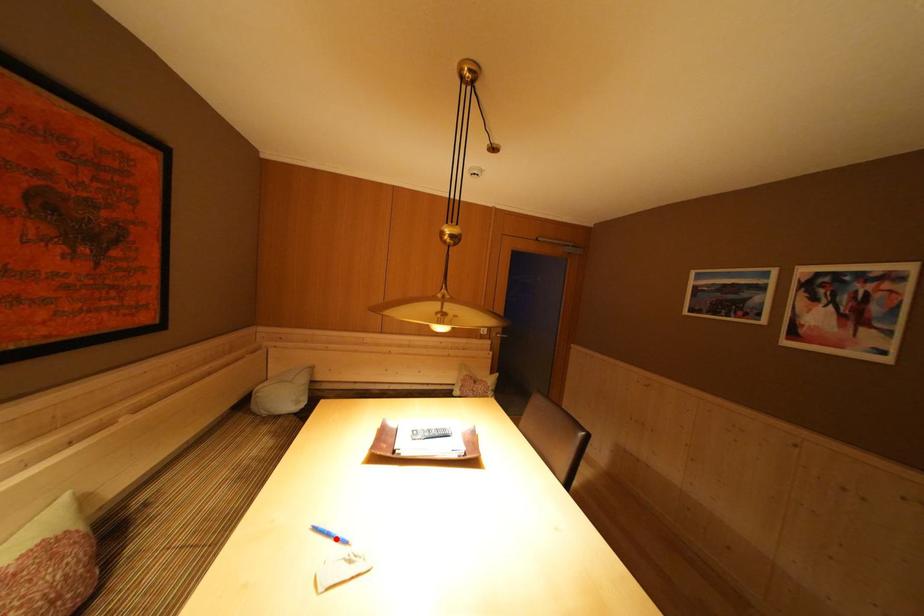
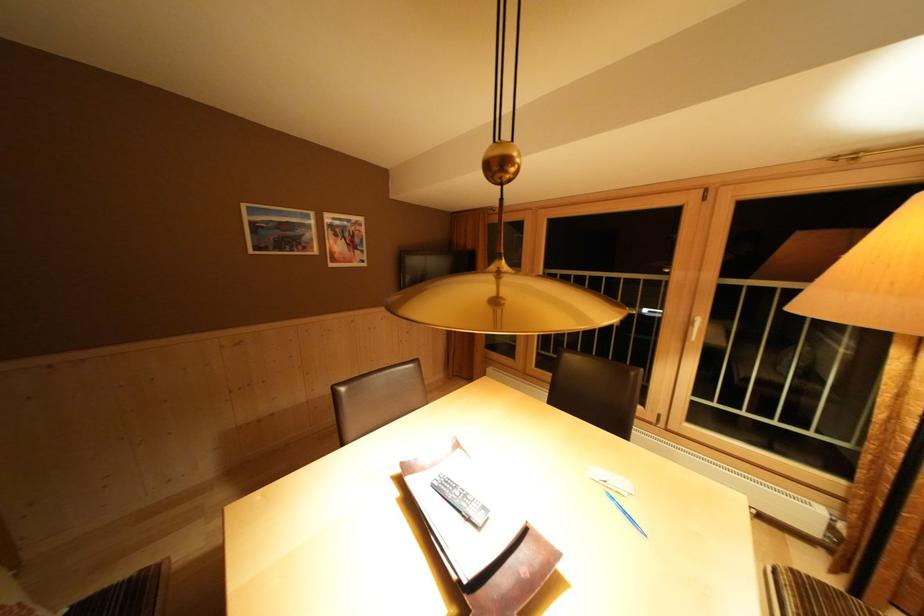
The point at the highlighted location is marked in the first image. Where is the corresponding point in the second image?

(633, 517)